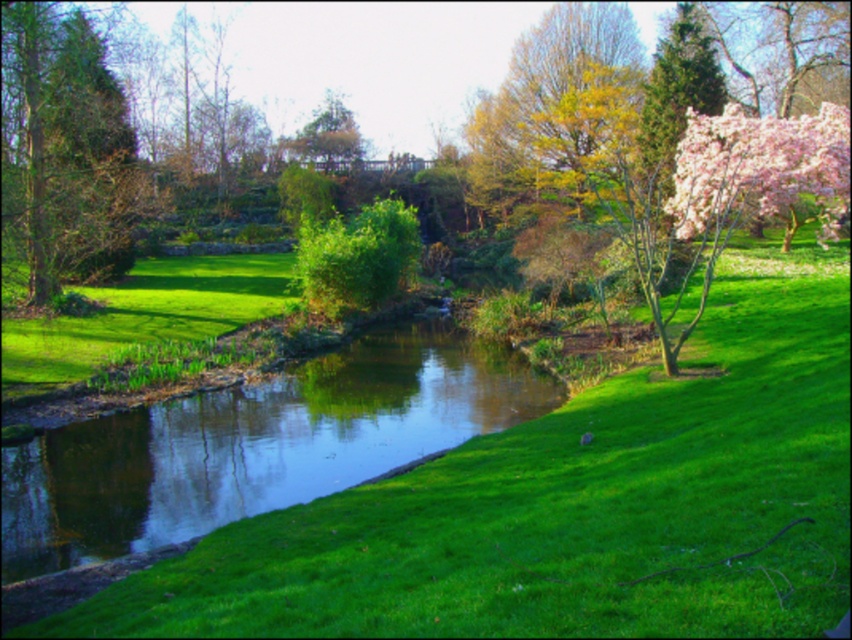
Based on the photo, you are standing at the viewpoint of the image and see two points marked in the park. The first point is at coordinate point [88,540] and the second is at point [26,58]. Which point is closer to you?

Point [88,540] is in front of point [26,58], so it is closer to you.

You are standing in the park and want to walk from the green grassy at center to the green grassy stream at center. Which path is wider?

The green grassy at center has a larger width than the green grassy stream at center, so the path through the green grassy at center is wider.